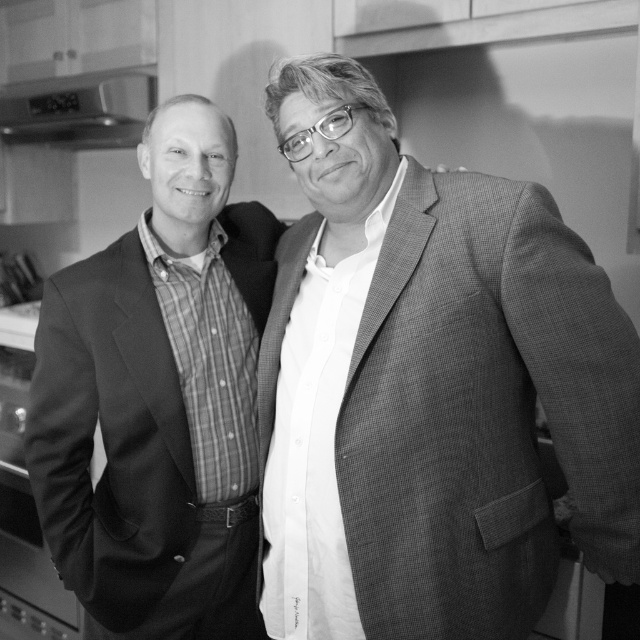
Question: Is matte black suit at left positioned in front of metallic silver exhaust hood at upper left?

Choices:
 (A) yes
 (B) no

Answer: (A)

Question: Is the position of matte black suit at left more distant than that of metallic silver exhaust hood at upper left?

Choices:
 (A) no
 (B) yes

Answer: (A)

Question: Can you confirm if matte black suit at left is positioned to the left of metallic silver exhaust hood at upper left?

Choices:
 (A) yes
 (B) no

Answer: (B)